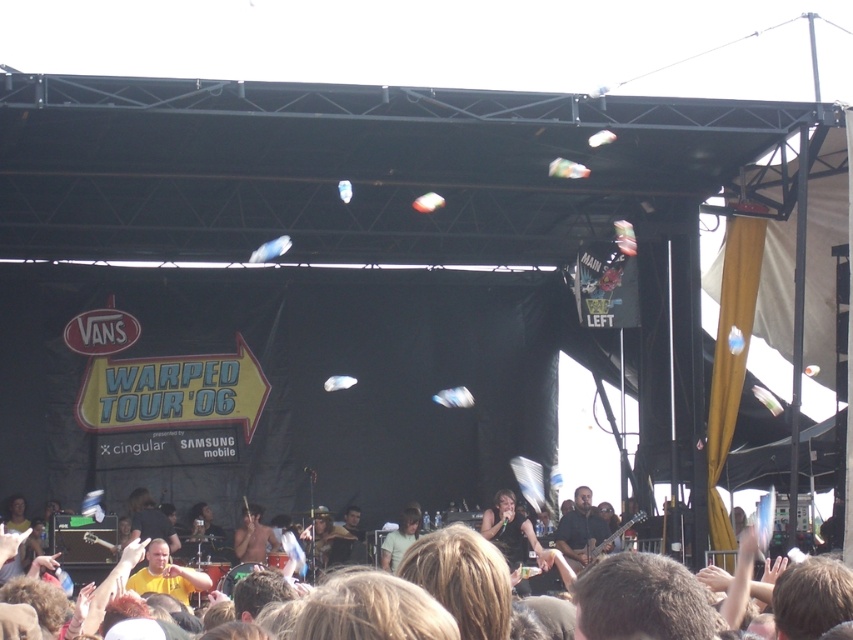
Question: Which point is farther from the camera taking this photo?

Choices:
 (A) (393, 540)
 (B) (241, 557)

Answer: (B)

Question: Does shiny metallic guitar at center have a greater width compared to light green t-shirt at center?

Choices:
 (A) yes
 (B) no

Answer: (A)

Question: Which of the following is the farthest from the observer?

Choices:
 (A) light green t-shirt at center
 (B) shiny metallic guitar at center
 (C) dark brown leather guitar at center

Answer: (B)

Question: Does dark brown leather guitar at center have a smaller size compared to light green t-shirt at center?

Choices:
 (A) no
 (B) yes

Answer: (A)

Question: Which object is closer to the camera taking this photo?

Choices:
 (A) dark brown leather guitar at center
 (B) shiny metallic guitar at center
 (C) light green t-shirt at center

Answer: (A)

Question: Can you confirm if dark brown leather guitar at center is wider than shiny metallic guitar at center?

Choices:
 (A) yes
 (B) no

Answer: (A)